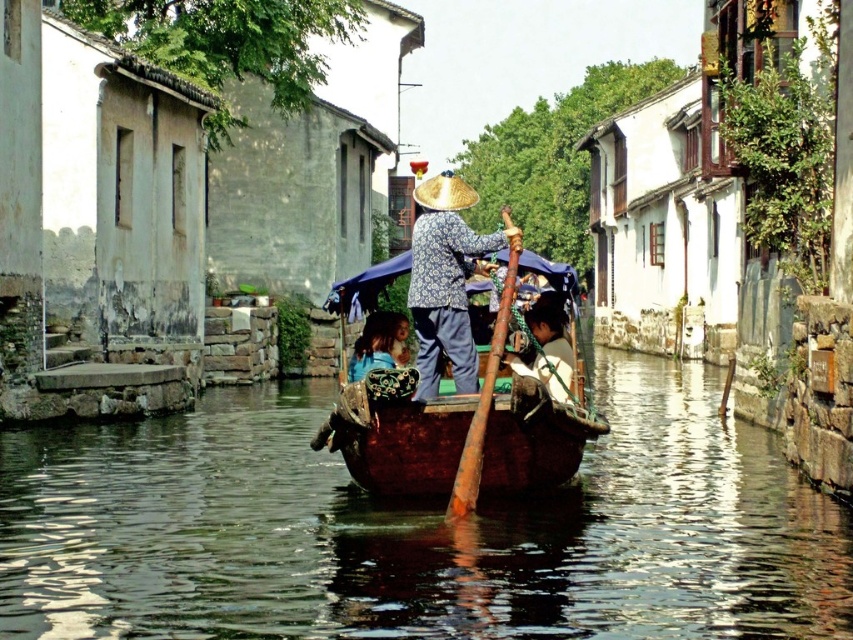
Between rusty wooden paddle at center and matte brown hat at center, which one has more height?

rusty wooden paddle at center

Does rusty wooden paddle at center have a lesser height compared to matte brown hat at center?

Incorrect, rusty wooden paddle at center's height does not fall short of matte brown hat at center's.

Identify the location of rusty wooden paddle at center. Image resolution: width=853 pixels, height=640 pixels. (483, 400).

This screenshot has height=640, width=853. Identify the location of rusty wooden paddle at center. (483, 400).

I want to click on matte brown hat at center, so click(548, 349).

Which of these two, matte brown hat at center or golden straw hat at center, stands shorter?

With less height is matte brown hat at center.

Which is in front, point (553, 333) or point (439, 192)?

Point (439, 192)

Where is `matte brown hat at center`? Image resolution: width=853 pixels, height=640 pixels. matte brown hat at center is located at coordinates (548, 349).

Can you confirm if brown wooden boat at center is smaller than rusty wooden paddle at center?

No.

Who is more forward, (410, 570) or (488, 355)?

Point (410, 570) is more forward.

This screenshot has height=640, width=853. Describe the element at coordinates (416, 529) in the screenshot. I see `brown wooden boat at center` at that location.

Identify the location of brown wooden boat at center. (416, 529).